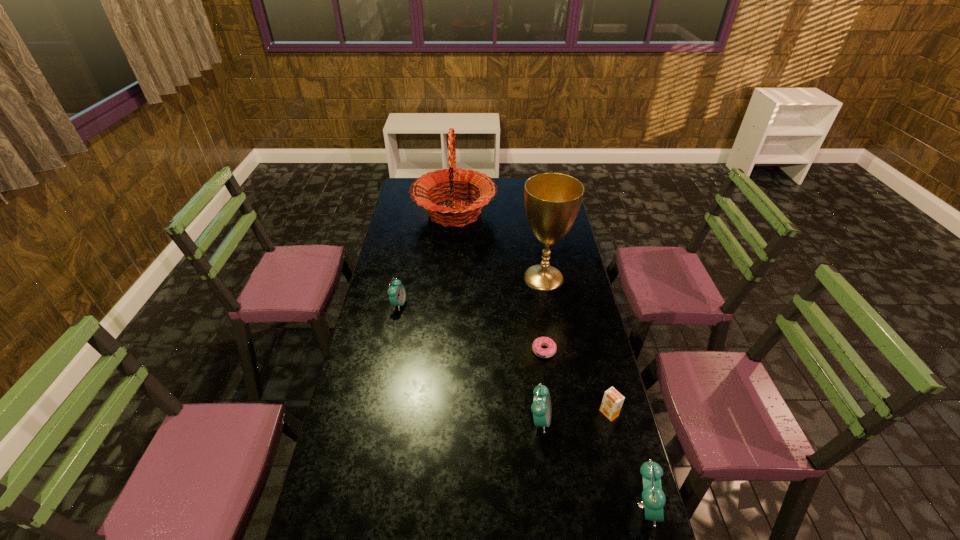
The image size is (960, 540). In order to click on the closest object to the second farthest object in this screenshot , I will do `click(474, 181)`.

Find the location of a particular element. The image size is (960, 540). alarm clock that can be found as the closest to the shortest alarm clock is located at coordinates (541, 407).

Where is `alarm clock that stands as the closest to the leftmost alarm clock`? The image size is (960, 540). alarm clock that stands as the closest to the leftmost alarm clock is located at coordinates click(x=541, y=407).

Identify the location of free location that satisfies the following two spatial constraints: 1. on the front side of the orange juice; 2. on the face of the second alarm clock from right to left. (611, 420).

This screenshot has width=960, height=540. I want to click on free spot that satisfies the following two spatial constraints: 1. on the front side of the trophy cup; 2. on the right side of the farthest object, so click(449, 278).

I want to click on free space that satisfies the following two spatial constraints: 1. on the face of the farthest alarm clock; 2. on the back side of the fourth nearest object, so click(x=390, y=350).